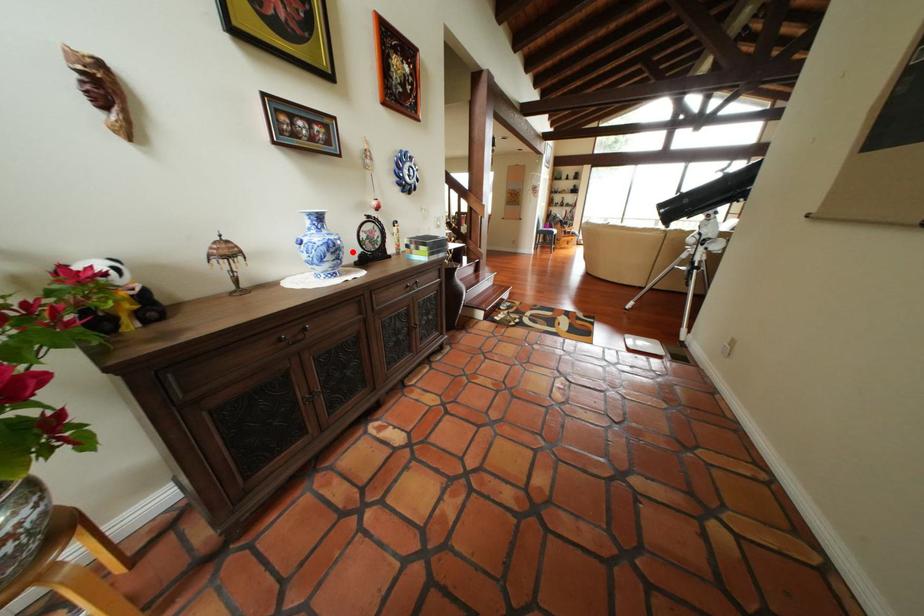
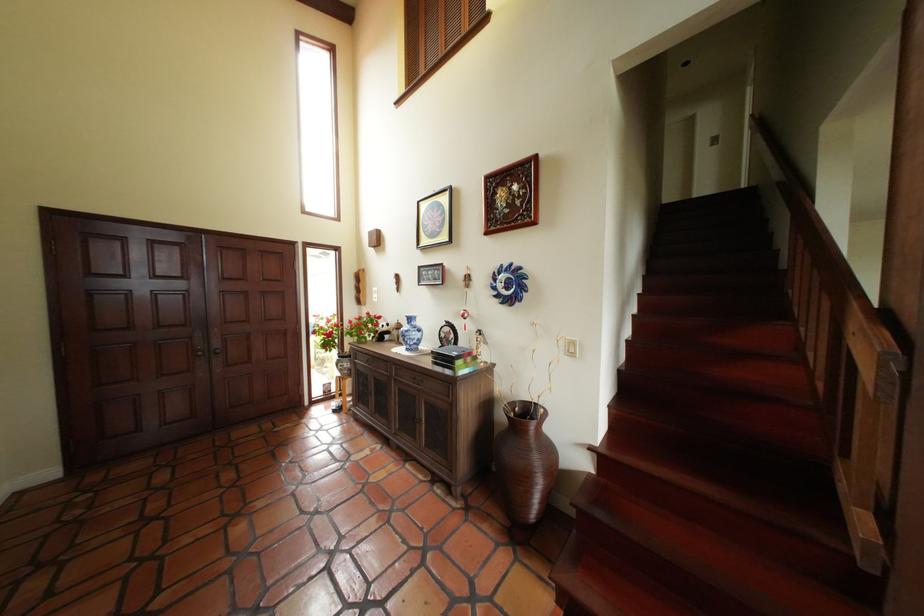
Question: A red point is marked in image1. In image2, is the corresponding 3D point closer to the camera or farther? Reply with the corresponding letter.

Choices:
 (A) The corresponding 3D point is closer.
 (B) The corresponding 3D point is farther.

Answer: (B)